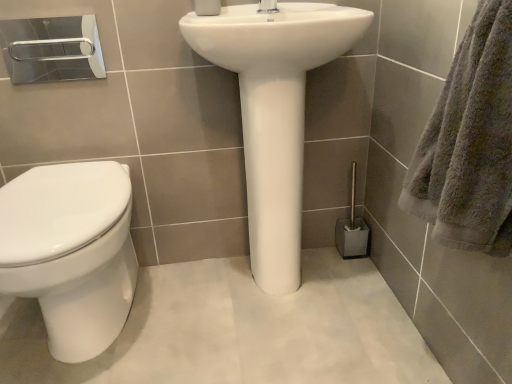
Question: Should I look upward or downward to see silver metallic towel bar at upper left?

Choices:
 (A) down
 (B) up

Answer: (B)

Question: Can you confirm if white glossy toilet at left is taller than gray fluffy towel at right?

Choices:
 (A) no
 (B) yes

Answer: (B)

Question: Can you see white glossy toilet at left touching gray fluffy towel at right?

Choices:
 (A) no
 (B) yes

Answer: (A)

Question: Does white glossy toilet at left lie in front of gray fluffy towel at right?

Choices:
 (A) yes
 (B) no

Answer: (B)

Question: Does white glossy toilet at left appear on the left side of gray fluffy towel at right?

Choices:
 (A) no
 (B) yes

Answer: (B)

Question: Can you confirm if white glossy toilet at left is smaller than gray fluffy towel at right?

Choices:
 (A) no
 (B) yes

Answer: (A)

Question: From the image's perspective, does white glossy toilet at left appear lower than gray fluffy towel at right?

Choices:
 (A) yes
 (B) no

Answer: (A)

Question: From a real-world perspective, is metallic silver toilet brush at lower right on silver metallic towel bar at upper left?

Choices:
 (A) yes
 (B) no

Answer: (B)

Question: Is metallic silver toilet brush at lower right aimed at silver metallic towel bar at upper left?

Choices:
 (A) no
 (B) yes

Answer: (A)

Question: Considering the relative sizes of metallic silver toilet brush at lower right and silver metallic towel bar at upper left in the image provided, is metallic silver toilet brush at lower right bigger than silver metallic towel bar at upper left?

Choices:
 (A) yes
 (B) no

Answer: (A)

Question: Considering the relative positions of metallic silver toilet brush at lower right and silver metallic towel bar at upper left in the image provided, is metallic silver toilet brush at lower right to the left of silver metallic towel bar at upper left from the viewer's perspective?

Choices:
 (A) no
 (B) yes

Answer: (A)

Question: Can you confirm if metallic silver toilet brush at lower right is taller than silver metallic towel bar at upper left?

Choices:
 (A) yes
 (B) no

Answer: (A)

Question: Is metallic silver toilet brush at lower right closer to the viewer compared to silver metallic towel bar at upper left?

Choices:
 (A) yes
 (B) no

Answer: (B)

Question: Is metallic silver toilet brush at lower right bigger than white matte toilet paper at upper center?

Choices:
 (A) no
 (B) yes

Answer: (B)